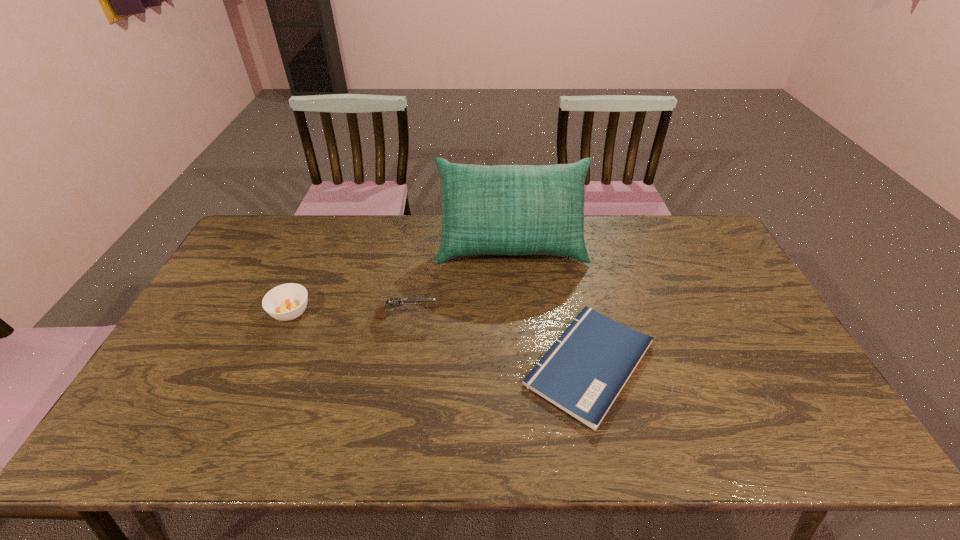
This screenshot has width=960, height=540. I want to click on the farthest object, so click(x=503, y=209).

Find the location of a particular element. The width and height of the screenshot is (960, 540). the tallest object is located at coordinates point(503,209).

Where is `the third shortest object`? The image size is (960, 540). the third shortest object is located at coordinates (390, 303).

Find the location of a particular element. The height and width of the screenshot is (540, 960). soup bowl is located at coordinates (286, 302).

The image size is (960, 540). What are the coordinates of `the third tallest object` in the screenshot? It's located at 286,302.

Identify the location of the shortest object. (584, 371).

Locate an element on the screen. This screenshot has width=960, height=540. vacant space located 0.080m on the front-facing side of the tallest object is located at coordinates (515, 289).

At what (x,y) coordinates should I click in order to perform the action: click on free space located aiming along the barrel of the third shortest object. Please return your answer as a coordinate pair (x, y). This screenshot has height=540, width=960. Looking at the image, I should click on (454, 317).

Image resolution: width=960 pixels, height=540 pixels. I want to click on vacant space positioned on the right of the leftmost object, so click(335, 313).

This screenshot has height=540, width=960. I want to click on vacant space located on the right of the paperback book, so click(x=722, y=364).